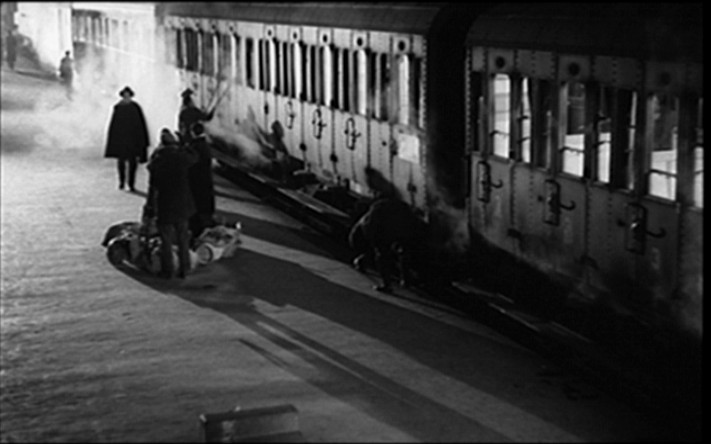
The image size is (711, 444). What are the coordinates of `handle` in the screenshot? It's located at (636, 224), (547, 198), (488, 182), (346, 135), (311, 126), (289, 118), (208, 85), (196, 84), (181, 80).